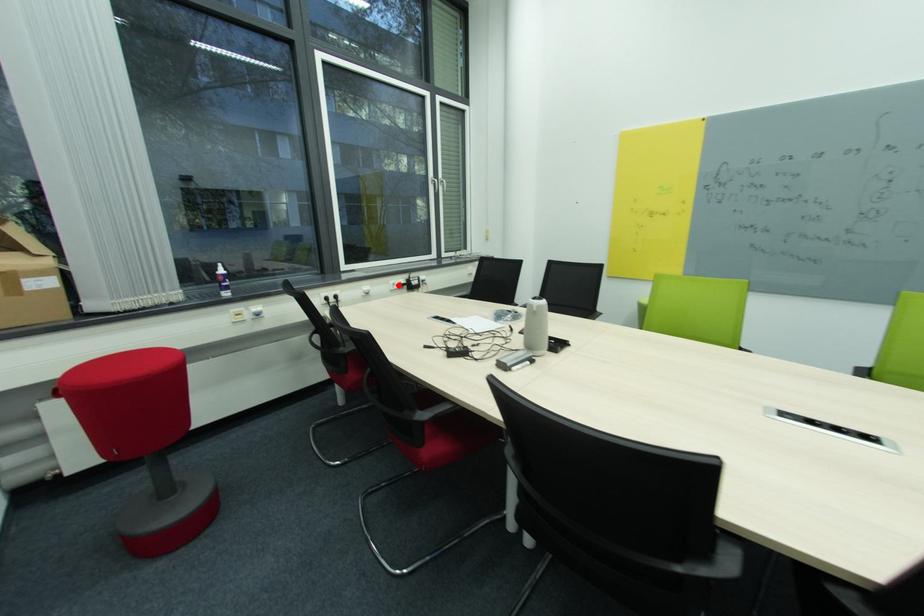
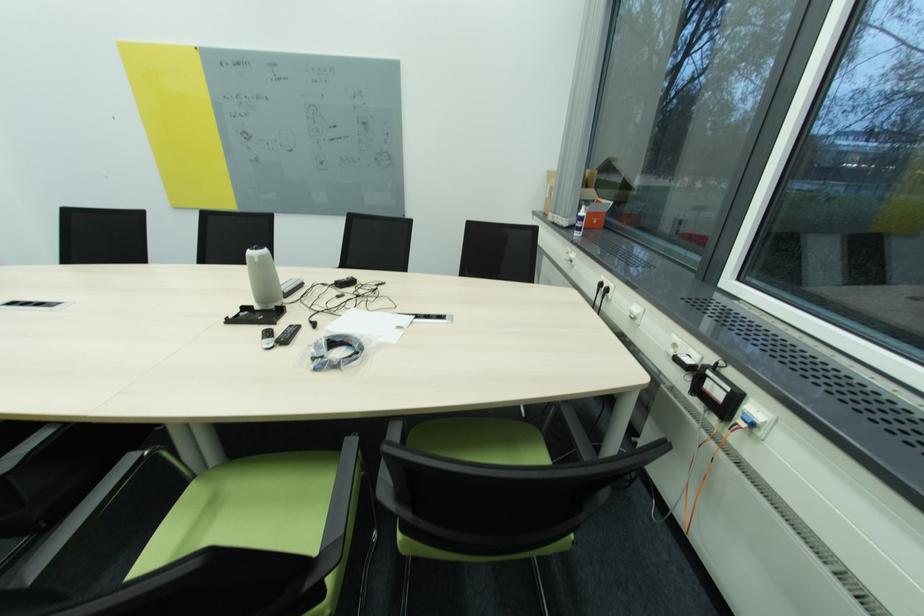
The point at the highlighted location is marked in the first image. Where is the corresponding point in the second image?

(679, 346)